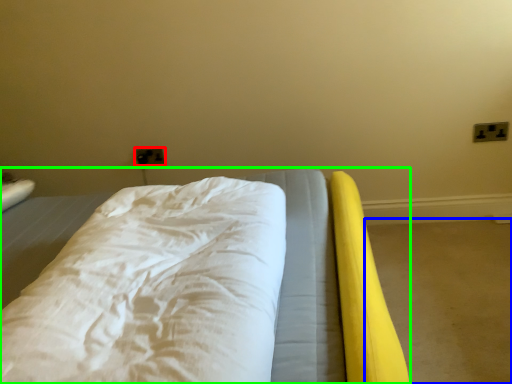
Question: Considering the real-world distances, which object is farthest from electric outlet (highlighted by a red box)? concrete (highlighted by a blue box) or bed (highlighted by a green box)?

Choices:
 (A) concrete
 (B) bed

Answer: (A)